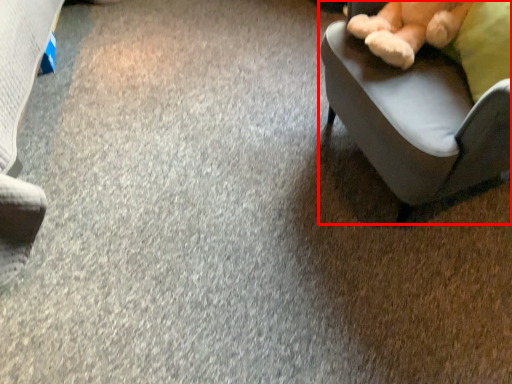
Question: Where is chair (annotated by the red box) located in relation to teddy bear in the image?

Choices:
 (A) left
 (B) right

Answer: (B)